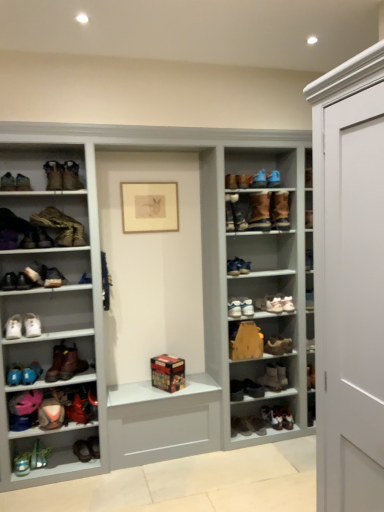
I want to click on free location in front of leather boot at center, the 3th footwear in the bottom-to-top sequence, so click(x=270, y=440).